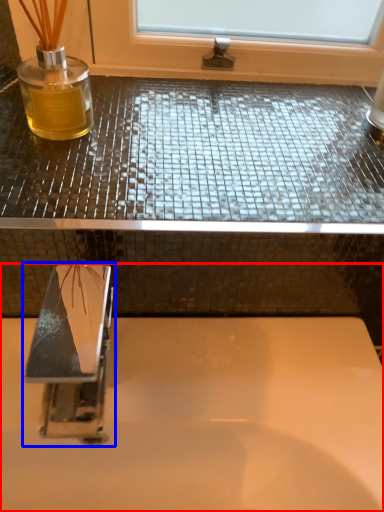
Question: Which of the following is the closest to the observer, sink (highlighted by a red box) or tap (highlighted by a blue box)?

Choices:
 (A) sink
 (B) tap

Answer: (B)